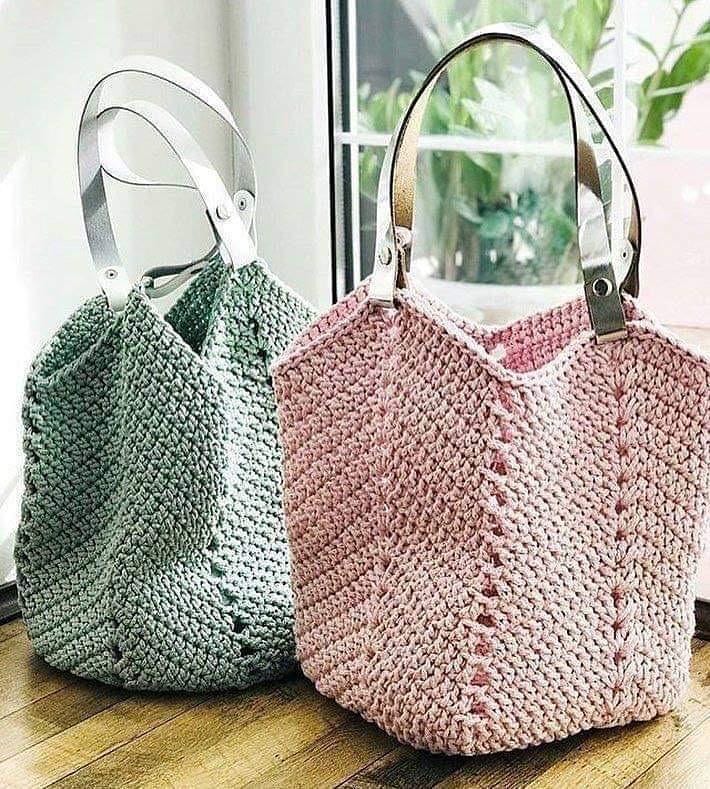
Locate an element on the screen. back wall is located at coordinates (204, 461), (50, 223).